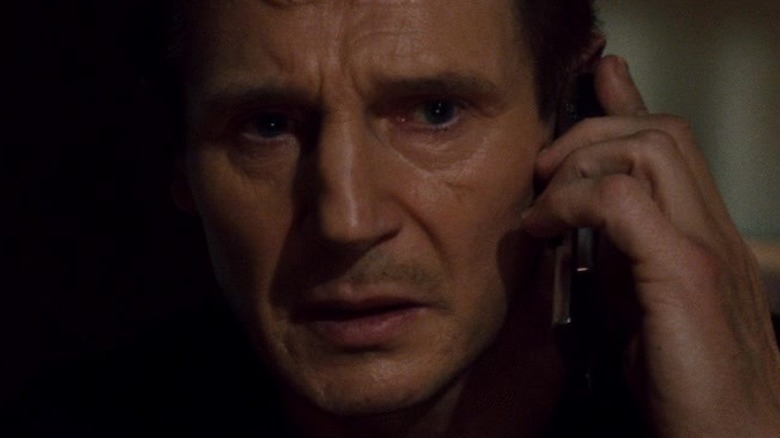
Image resolution: width=780 pixels, height=438 pixels. In order to click on black phone in this screenshot , I will do `click(583, 289)`.